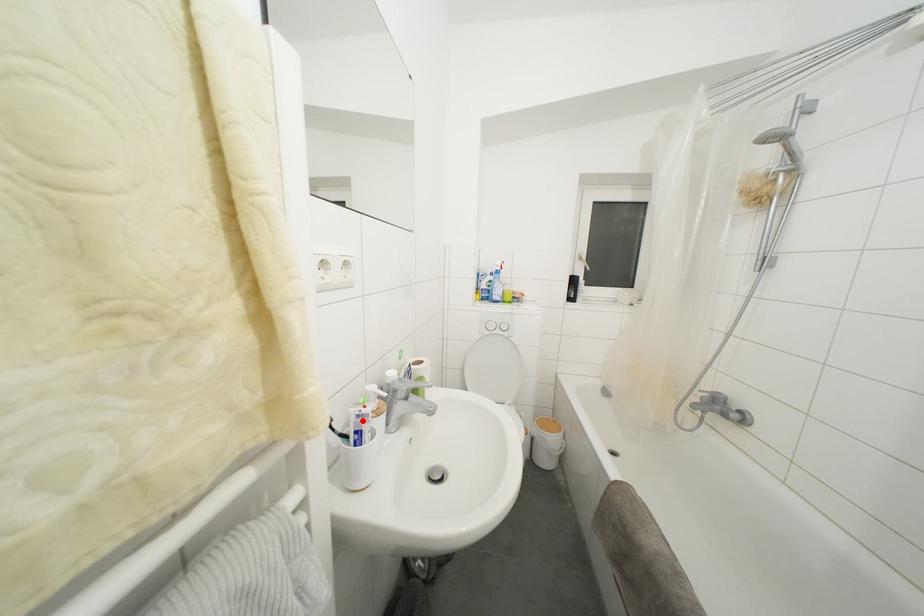
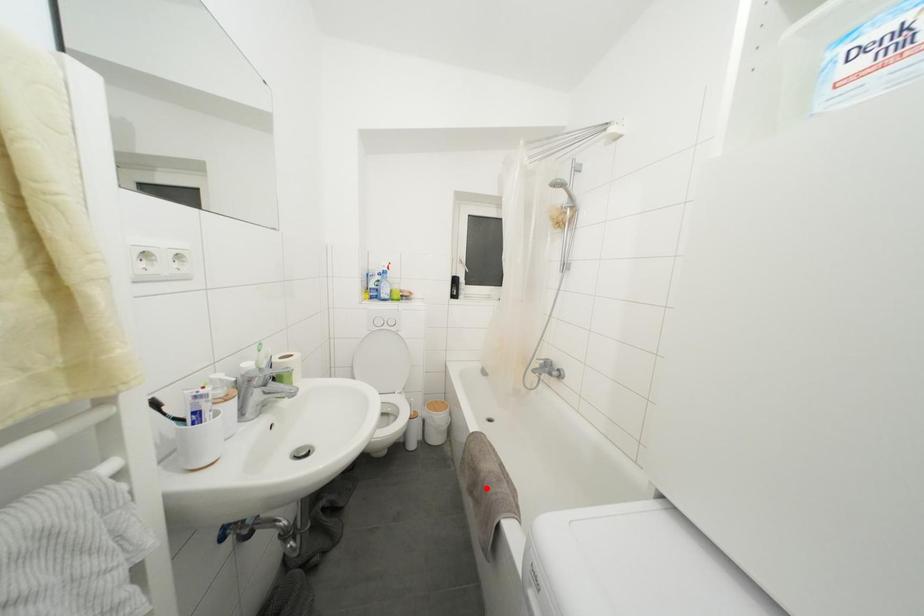
I am providing you with two images of the same scene from different viewpoints. A red point is marked on the first image and another point is marked on the second image. Is the marked point in image1 the same physical position as the marked point in image2?

→ No